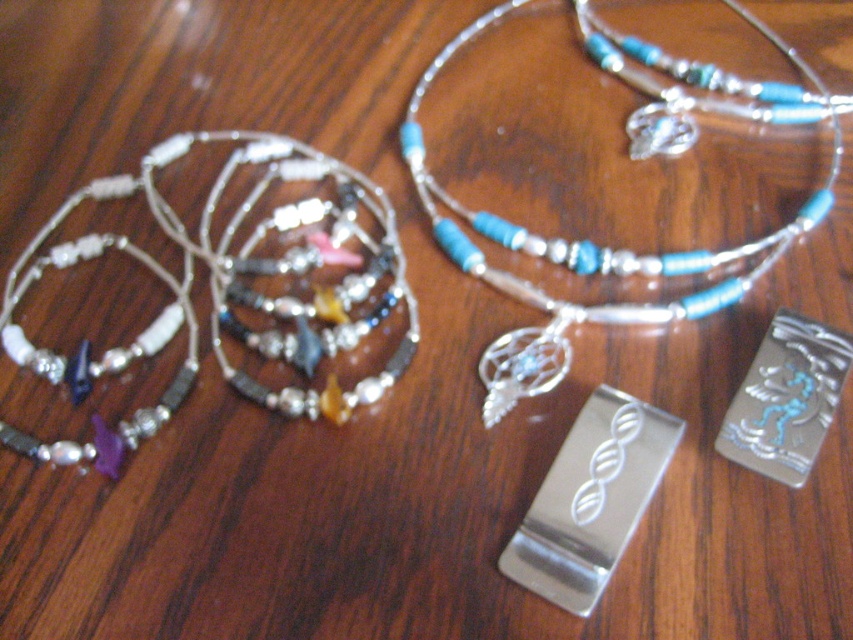
Question: Does multicolored beaded necklace at left lie in front of polished metal bookmark at center?

Choices:
 (A) yes
 (B) no

Answer: (B)

Question: Is multicolored beaded necklace at left thinner than polished metal bookmark at center?

Choices:
 (A) no
 (B) yes

Answer: (A)

Question: Which point is closer to the camera?

Choices:
 (A) multicolored beaded necklace at left
 (B) polished metal bookmark at center
 (C) blue beaded necklace at center

Answer: (B)

Question: Which of the following is the farthest from the observer?

Choices:
 (A) polished metal bookmark at center
 (B) multicolored beaded necklace at left
 (C) blue beaded necklace at center

Answer: (C)

Question: Which point is closer to the camera taking this photo?

Choices:
 (A) (45, 257)
 (B) (585, 588)
 (C) (718, 292)

Answer: (B)

Question: Is blue beaded necklace at center positioned at the back of polished metal bookmark at center?

Choices:
 (A) no
 (B) yes

Answer: (B)